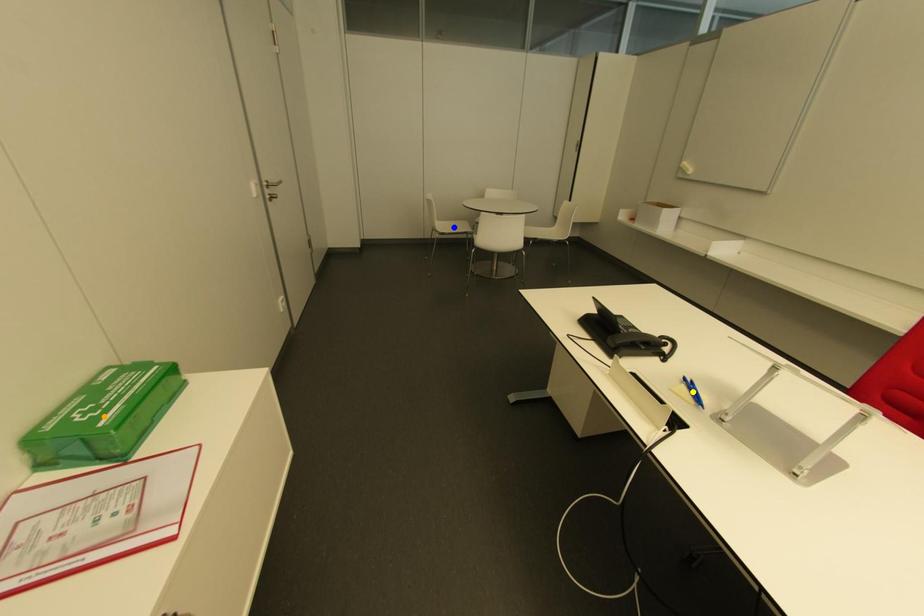
Order these from nearest to farthest:
- blue point
- yellow point
- orange point

1. orange point
2. yellow point
3. blue point